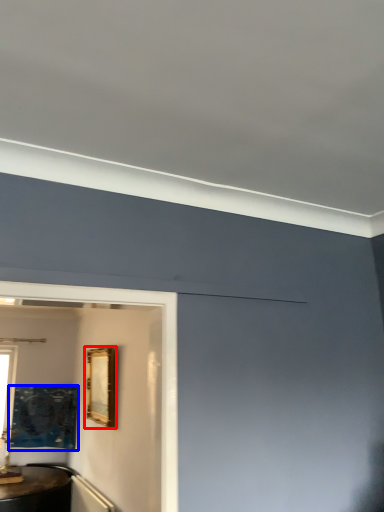
Question: Which object appears farthest to the camera in this image, picture frame (highlighted by a red box) or picture frame (highlighted by a blue box)?

Choices:
 (A) picture frame
 (B) picture frame

Answer: (B)